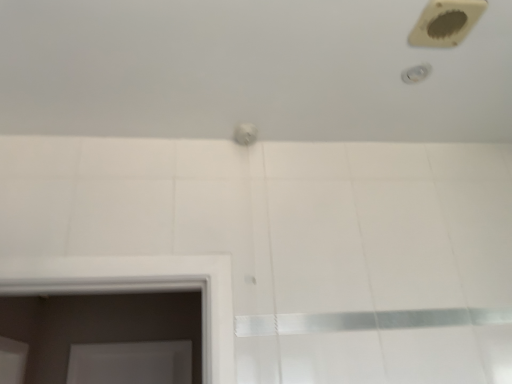
Question: Does white glossy bath at upper center have a greater height compared to beige plastic hole at upper right?

Choices:
 (A) yes
 (B) no

Answer: (A)

Question: Can you confirm if white glossy bath at upper center is smaller than beige plastic hole at upper right?

Choices:
 (A) yes
 (B) no

Answer: (B)

Question: From a real-world perspective, is white glossy bath at upper center physically above beige plastic hole at upper right?

Choices:
 (A) yes
 (B) no

Answer: (A)

Question: Is white glossy bath at upper center positioned beyond the bounds of beige plastic hole at upper right?

Choices:
 (A) no
 (B) yes

Answer: (B)

Question: Is white glossy bath at upper center shorter than beige plastic hole at upper right?

Choices:
 (A) yes
 (B) no

Answer: (B)

Question: Can you see white glossy bath at upper center touching beige plastic hole at upper right?

Choices:
 (A) no
 (B) yes

Answer: (A)

Question: Does white glossy shower at upper right have a lesser height compared to white glossy bath at upper center?

Choices:
 (A) no
 (B) yes

Answer: (B)

Question: From the image's perspective, is white glossy shower at upper right on white glossy bath at upper center?

Choices:
 (A) no
 (B) yes

Answer: (B)

Question: From a real-world perspective, is white glossy shower at upper right physically below white glossy bath at upper center?

Choices:
 (A) no
 (B) yes

Answer: (B)

Question: Is white glossy shower at upper right oriented away from white glossy bath at upper center?

Choices:
 (A) yes
 (B) no

Answer: (A)

Question: Can you confirm if white glossy shower at upper right is thinner than white glossy bath at upper center?

Choices:
 (A) yes
 (B) no

Answer: (A)

Question: Is white glossy shower at upper right to the left of white glossy bath at upper center from the viewer's perspective?

Choices:
 (A) no
 (B) yes

Answer: (A)

Question: Is white glossy bath at upper center smaller than white glossy shower at upper right?

Choices:
 (A) yes
 (B) no

Answer: (B)